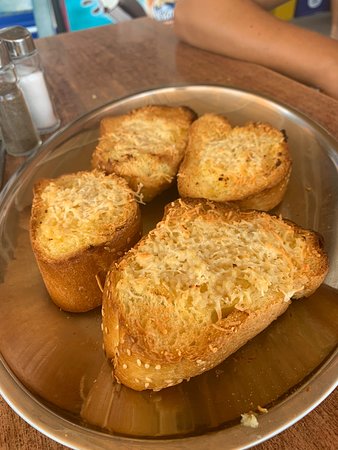
What are the coordinates of `crumb` in the screenshot? It's located at (259, 423).